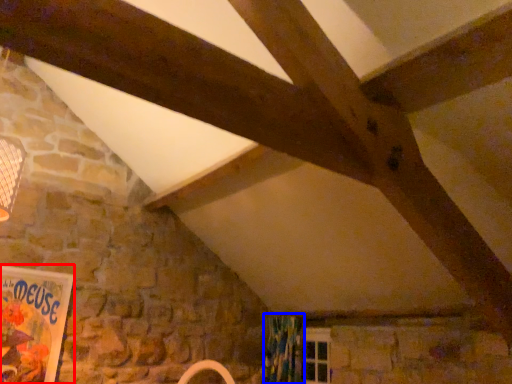
Question: Which object is further to the camera taking this photo, bulletin board (highlighted by a red box) or curtain (highlighted by a blue box)?

Choices:
 (A) bulletin board
 (B) curtain

Answer: (B)